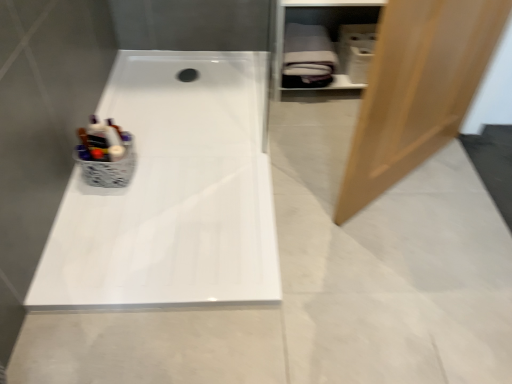
What do you see at coordinates (172, 193) in the screenshot?
I see `white glossy bathtub at center` at bounding box center [172, 193].

Where is `light brown wood door at right`? The height and width of the screenshot is (384, 512). light brown wood door at right is located at coordinates (417, 89).

I want to click on white matte shelf at upper right, so (x=318, y=23).

Is white glossy bathtub at center a part of light brown wood door at right?

No, light brown wood door at right does not contain white glossy bathtub at center.

Is light brown wood door at right positioned before white glossy bathtub at center?

Yes, light brown wood door at right is closer to the viewer.

Is point (416, 39) closer to viewer compared to point (95, 202)?

Yes, it is in front of point (95, 202).

Measure the distance between white glossy bathtub at center and white matte shelf at upper right.

The distance of white glossy bathtub at center from white matte shelf at upper right is 27.11 inches.

From a real-world perspective, is white glossy bathtub at center under white matte shelf at upper right?

Yes, from a real-world perspective, white glossy bathtub at center is under white matte shelf at upper right.

Considering the positions of objects white glossy bathtub at center and white matte shelf at upper right in the image provided, who is in front, white glossy bathtub at center or white matte shelf at upper right?

white glossy bathtub at center is more forward.

Considering the positions of objects white glossy bathtub at center and white matte shelf at upper right in the image provided, who is more to the left, white glossy bathtub at center or white matte shelf at upper right?

white glossy bathtub at center is more to the left.

From a real-world perspective, is white glossy bathtub at center above or below light brown wood door at right?

Clearly, from a real-world perspective, white glossy bathtub at center is below light brown wood door at right.

From the picture: Is white glossy bathtub at center situated inside light brown wood door at right or outside?

white glossy bathtub at center cannot be found inside light brown wood door at right.

Can you confirm if white glossy bathtub at center is thinner than light brown wood door at right?

No.

Considering the sizes of objects white glossy bathtub at center and light brown wood door at right in the image provided, who is shorter, white glossy bathtub at center or light brown wood door at right?

With less height is white glossy bathtub at center.

Based on the photo, from a real-world perspective, which object rests below the other?

In real-world perspective, white glossy bathtub at center is lower.

Is point (355, 84) less distant than point (212, 64)?

Yes, it is in front of point (212, 64).

Between white matte shelf at upper right and white glossy bathtub at center, which one has smaller size?

With smaller size is white glossy bathtub at center.

Does white matte shelf at upper right lie behind white glossy bathtub at center?

That is True.

Looking at the image, does white matte shelf at upper right seem bigger or smaller compared to light brown wood door at right?

Clearly, white matte shelf at upper right is smaller in size than light brown wood door at right.

Is white matte shelf at upper right at the right side of light brown wood door at right?

In fact, white matte shelf at upper right is to the left of light brown wood door at right.

Consider the image. Measure the distance between white matte shelf at upper right and light brown wood door at right.

The distance of white matte shelf at upper right from light brown wood door at right is 28.80 inches.

This screenshot has height=384, width=512. In order to click on shelf directly beneath the light brown wood door at right (from a real-world perspective) in this screenshot , I will do `click(318, 23)`.

Who is smaller, light brown wood door at right or white matte shelf at upper right?

Smaller between the two is white matte shelf at upper right.

Is light brown wood door at right to the left of white matte shelf at upper right from the viewer's perspective?

Incorrect, light brown wood door at right is not on the left side of white matte shelf at upper right.

Where is `shelf above the light brown wood door at right (from the image's perspective)`? The width and height of the screenshot is (512, 384). shelf above the light brown wood door at right (from the image's perspective) is located at coordinates (318, 23).

Is light brown wood door at right further to the viewer compared to white matte shelf at upper right?

No.

You are a GUI agent. You are given a task and a screenshot of the screen. Output one action in this format:
    pyautogui.click(x=<x>, y=<y>)
    Task: Click on the bathtub that appears below the light brown wood door at right (from the image's perspective)
    
    Given the screenshot: What is the action you would take?
    pyautogui.click(x=172, y=193)

You are a GUI agent. You are given a task and a screenshot of the screen. Output one action in this format:
    pyautogui.click(x=<x>, y=<y>)
    Task: Click on the bathtub on the left of the white matte shelf at upper right
    The height and width of the screenshot is (384, 512).
    Given the screenshot: What is the action you would take?
    pyautogui.click(x=172, y=193)

From the image, which object appears to be farther from white matte shelf at upper right, white glossy bathtub at center or light brown wood door at right?

light brown wood door at right lies further to white matte shelf at upper right than the other object.

From the image, which object appears to be farther from white matte shelf at upper right, light brown wood door at right or white glossy bathtub at center?

light brown wood door at right is positioned further to the anchor white matte shelf at upper right.

Considering their positions, is white matte shelf at upper right positioned further to light brown wood door at right than white glossy bathtub at center?

white matte shelf at upper right is further to light brown wood door at right.

Estimate the real-world distances between objects in this image. Which object is closer to white glossy bathtub at center, light brown wood door at right or white matte shelf at upper right?

light brown wood door at right.

Looking at the image, which one is located closer to light brown wood door at right, white glossy bathtub at center or white matte shelf at upper right?

The object closer to light brown wood door at right is white glossy bathtub at center.

From the image, which object appears to be nearer to white glossy bathtub at center, white matte shelf at upper right or light brown wood door at right?

light brown wood door at right is closer to white glossy bathtub at center.

The height and width of the screenshot is (384, 512). What are the coordinates of `shelf located between white glossy bathtub at center and light brown wood door at right in the left-right direction` in the screenshot? It's located at (318, 23).